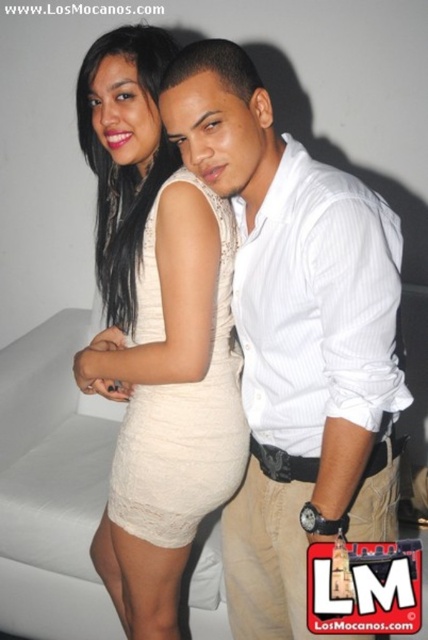
Question: Can you confirm if white striped shirt at center is smaller than white fabric couch at lower left?

Choices:
 (A) no
 (B) yes

Answer: (B)

Question: Considering the real-world distances, which object is closest to the white fabric couch at lower left?

Choices:
 (A) white striped shirt at center
 (B) lace beige dress at center

Answer: (B)

Question: From the image, what is the correct spatial relationship of white striped shirt at center in relation to lace beige dress at center?

Choices:
 (A) below
 (B) above

Answer: (A)

Question: In this image, where is white striped shirt at center located relative to white fabric couch at lower left?

Choices:
 (A) left
 (B) right

Answer: (B)

Question: Which point is closer to the camera taking this photo?

Choices:
 (A) 142,422
 (B) 259,204
 (C) 50,637

Answer: (B)

Question: Which point is closer to the camera?

Choices:
 (A) (333, 416)
 (B) (14, 364)
 (C) (139, 445)

Answer: (A)